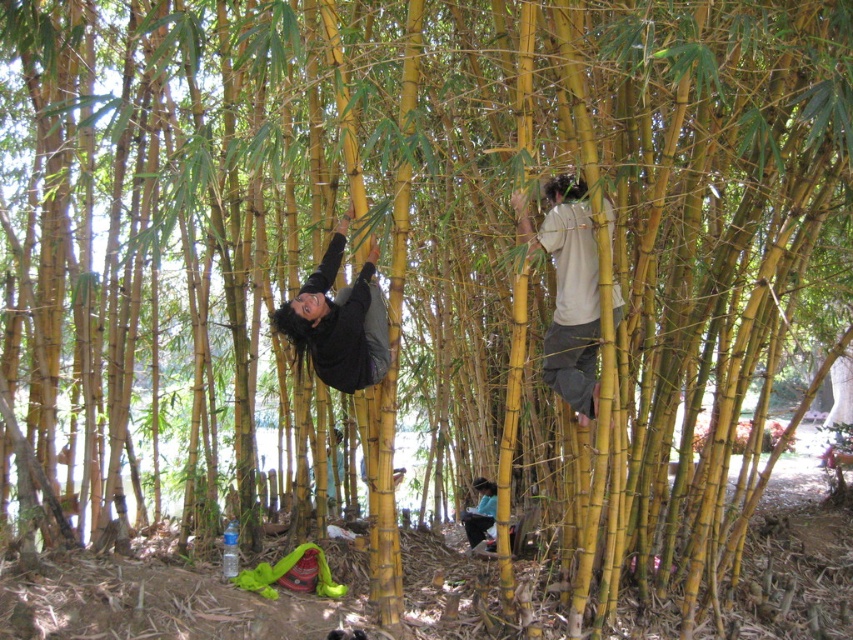
Question: Is white matte shirt at upper right to the right of dark gray fabric at lower center from the viewer's perspective?

Choices:
 (A) yes
 (B) no

Answer: (A)

Question: Which point appears farthest from the camera in this image?

Choices:
 (A) (376, 328)
 (B) (466, 509)
 (C) (582, 312)

Answer: (B)

Question: Among these points, which one is nearest to the camera?

Choices:
 (A) (589, 326)
 (B) (376, 296)

Answer: (B)

Question: Can you confirm if white matte shirt at upper right is thinner than black matte shirt at center?

Choices:
 (A) yes
 (B) no

Answer: (A)

Question: Which object appears closest to the camera in this image?

Choices:
 (A) dark gray fabric at lower center
 (B) black matte shirt at center
 (C) white matte shirt at upper right

Answer: (C)

Question: Can you confirm if black matte shirt at center is bigger than dark gray fabric at lower center?

Choices:
 (A) no
 (B) yes

Answer: (B)